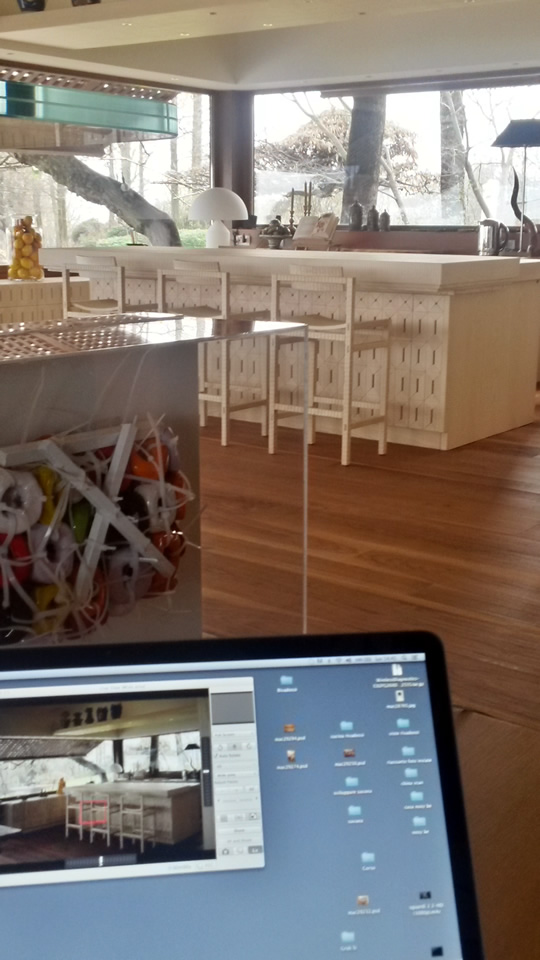
Locate an element on the screen. Image resolution: width=540 pixels, height=960 pixels. chairs is located at coordinates (356, 333), (207, 308), (103, 306).